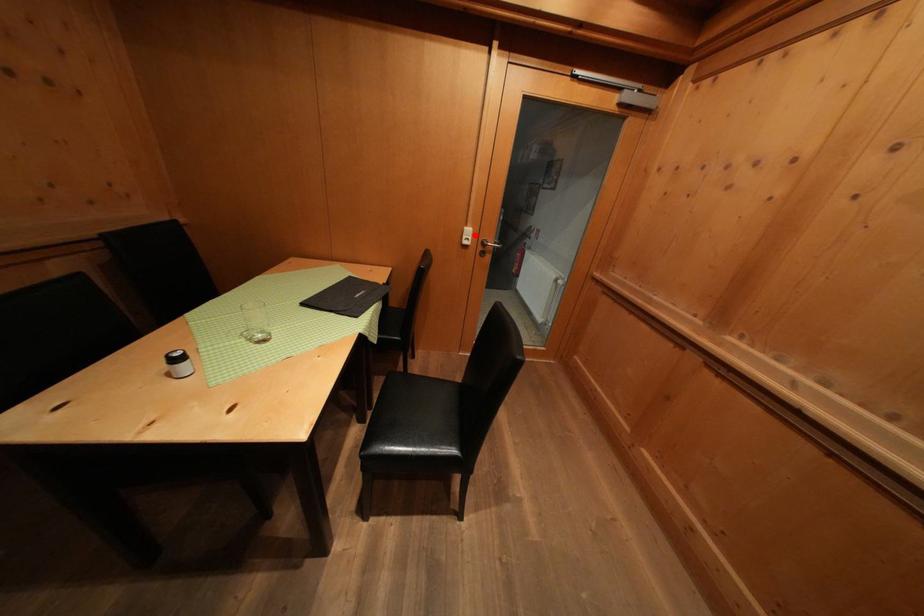
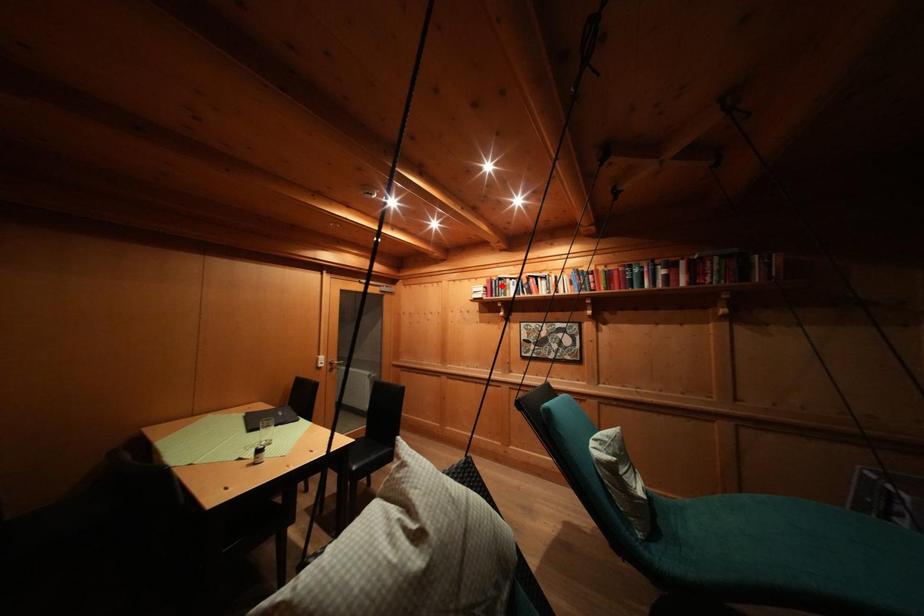
I am providing you with two images of the same scene from different viewpoints. A red point is marked on the first image and another point is marked on the second image. Is the marked point in image1 the same physical position as the marked point in image2?

No